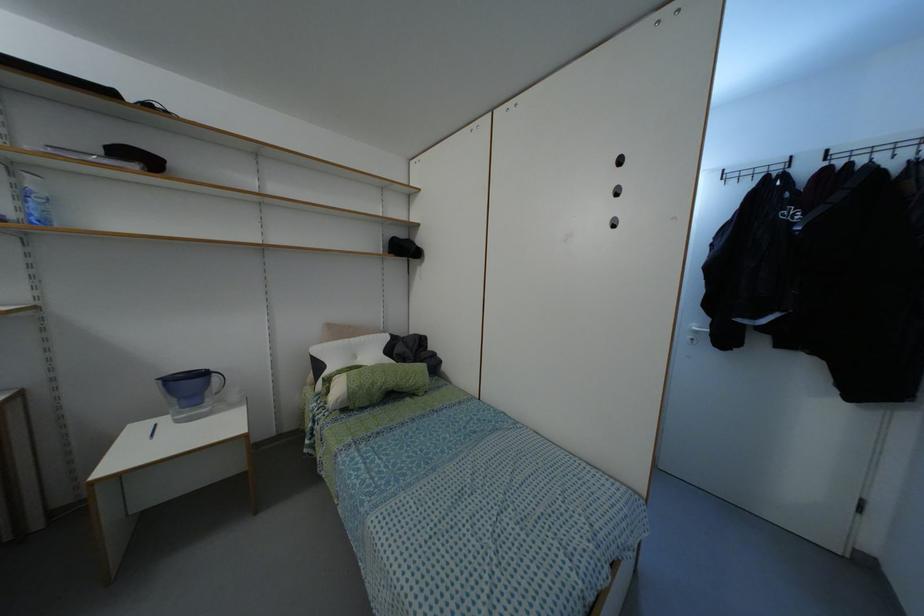
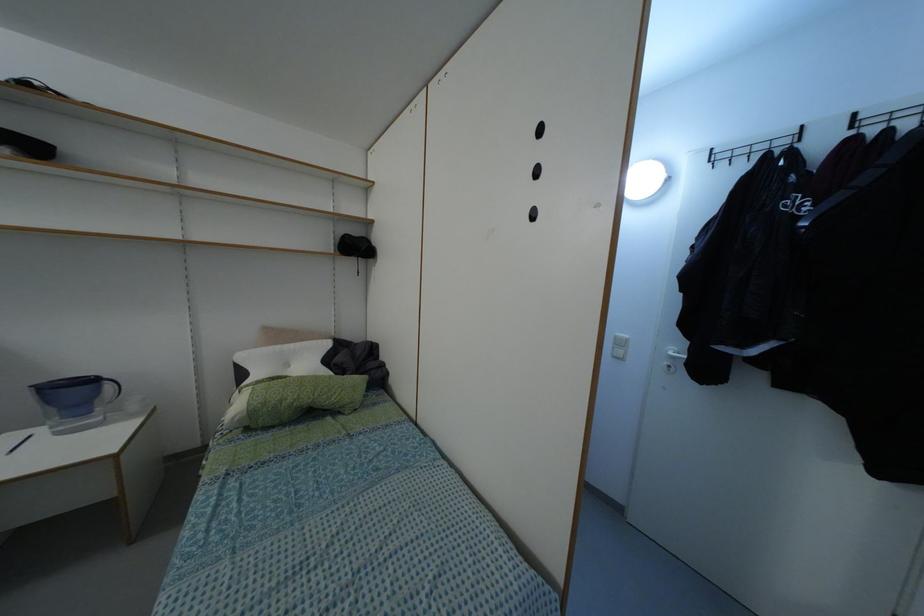
The images are taken continuously from a first-person perspective. In which direction are you moving?

The cameraman walked toward right, forward.